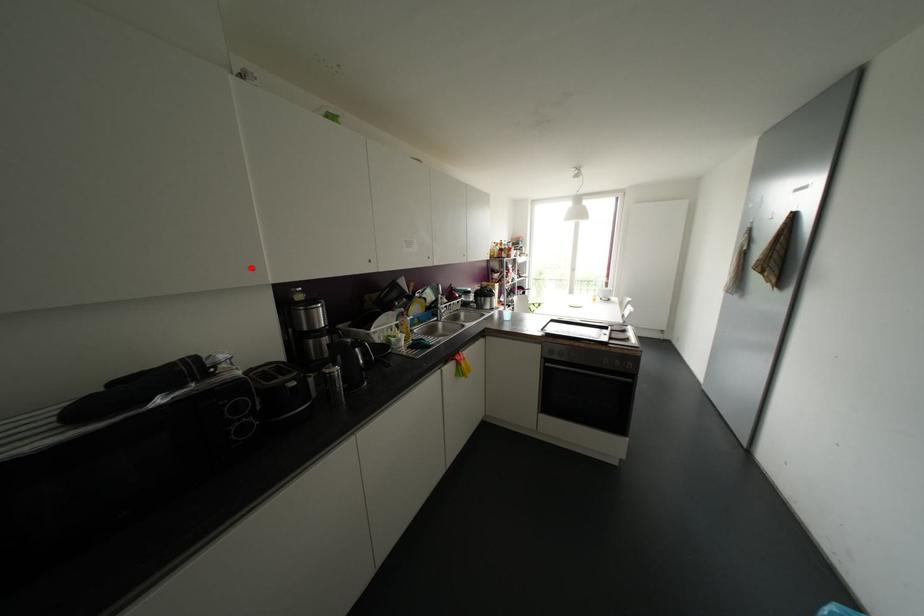
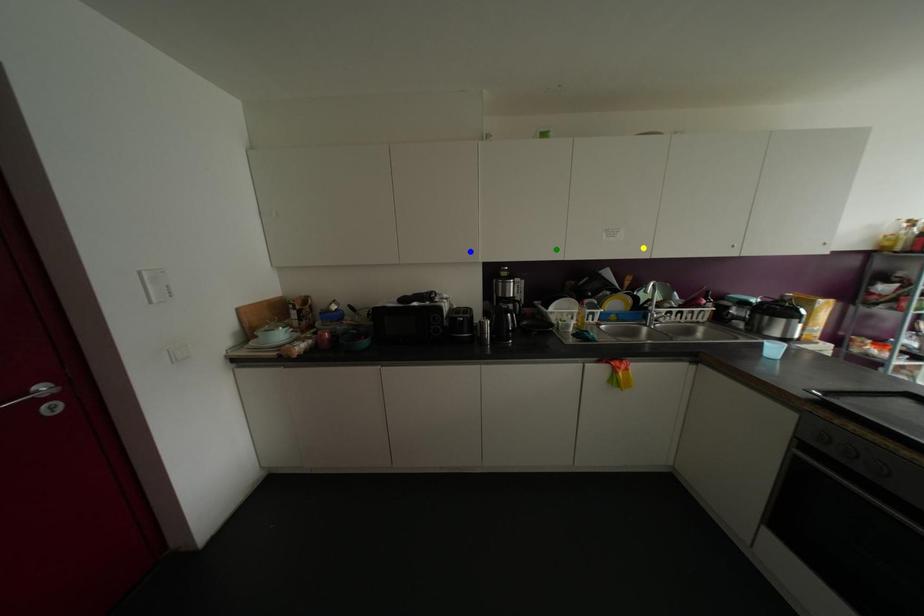
Question: I am providing you with two images of the same scene from different viewpoints. A red point is marked on the first image. You are given multiple points on the second image. Which mark in image 2 goes with the point in image 1?

Choices:
 (A) yellow point
 (B) blue point
 (C) green point

Answer: (B)